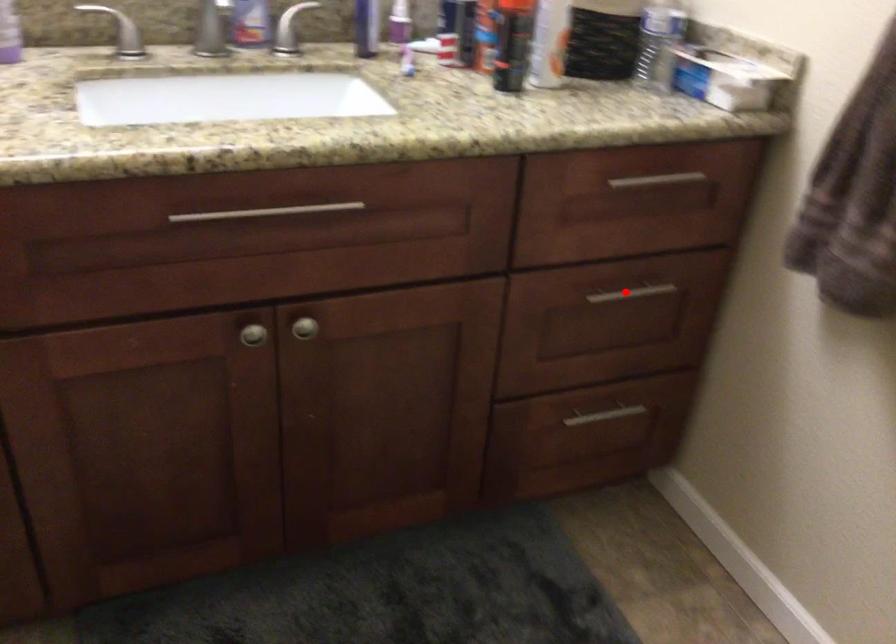
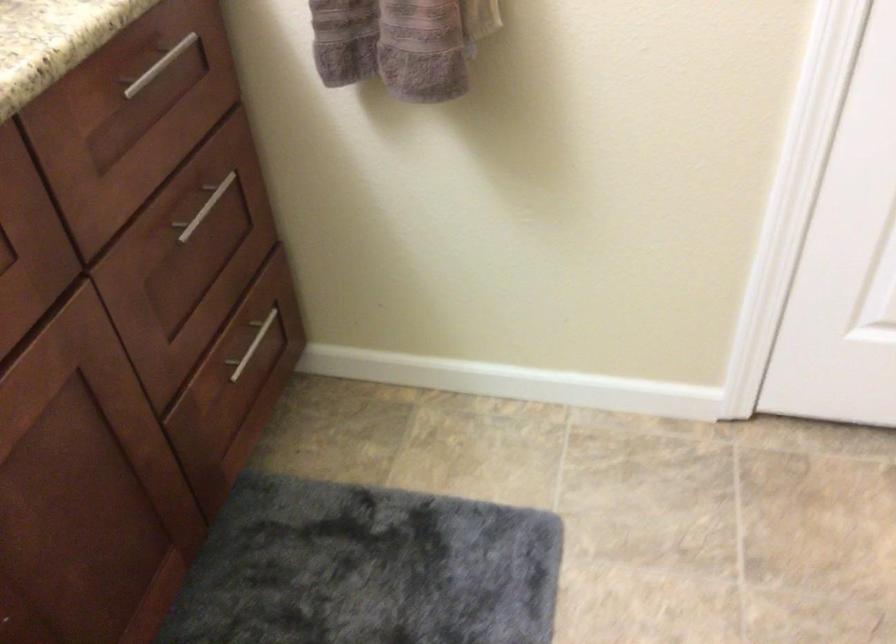
Where in the second image is the point corresponding to the highlighted location from the first image?

(203, 207)